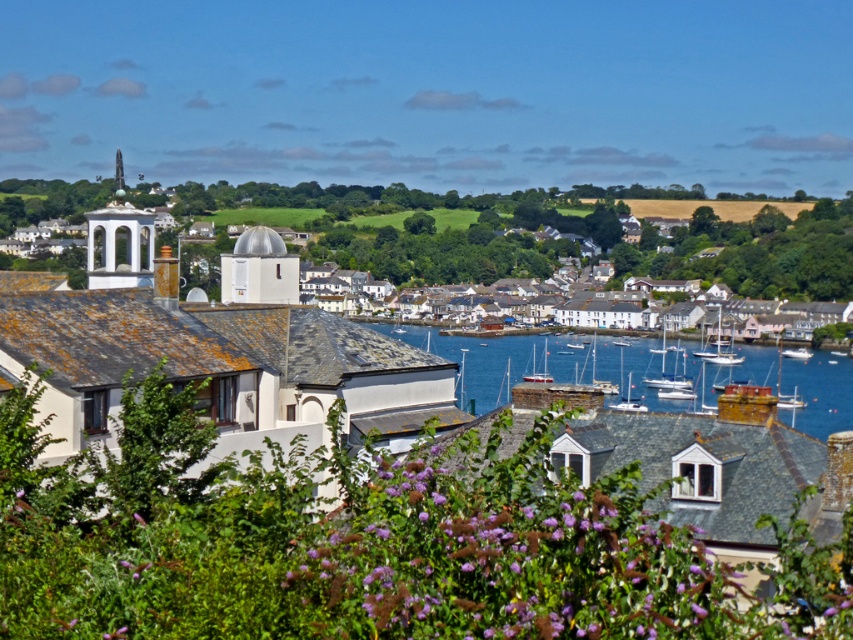
Who is shorter, white glossy sailboat at center-right or white sailboat at center?

white sailboat at center

Does point (693, 352) come farther from viewer compared to point (543, 376)?

That is True.

Is point (734, 362) farther from camera compared to point (525, 376)?

Yes, it is behind point (525, 376).

Image resolution: width=853 pixels, height=640 pixels. Identify the location of white glossy sailboat at center-right. (718, 348).

Can you confirm if white sailboat at center is taller than white glossy boat at center?

Yes, white sailboat at center is taller than white glossy boat at center.

You are a GUI agent. You are given a task and a screenshot of the screen. Output one action in this format:
    pyautogui.click(x=<x>, y=<y>)
    Task: Click on the white sailboat at center
    
    Given the screenshot: What is the action you would take?
    pyautogui.click(x=537, y=371)

Which is in front, point (534, 349) or point (621, 339)?

Positioned in front is point (534, 349).

The image size is (853, 640). Find the location of `white sailboat at center`. white sailboat at center is located at coordinates (537, 371).

Can you confirm if white stucco bell tower at upper left is positioned below white glossy boat at center?

No.

Find the location of a particular element. Image resolution: width=853 pixels, height=640 pixels. white stucco bell tower at upper left is located at coordinates (125, 241).

This screenshot has height=640, width=853. I want to click on white stucco bell tower at upper left, so click(x=125, y=241).